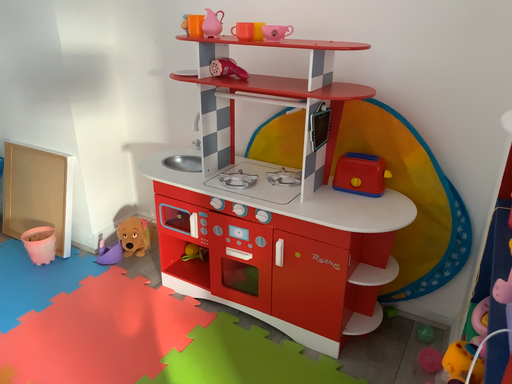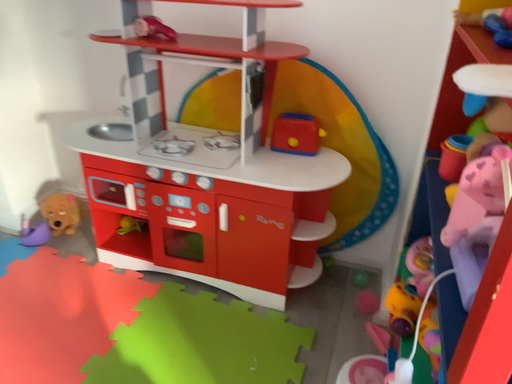
Question: Which way did the camera rotate in the video?

Choices:
 (A) rotated right
 (B) rotated left

Answer: (A)